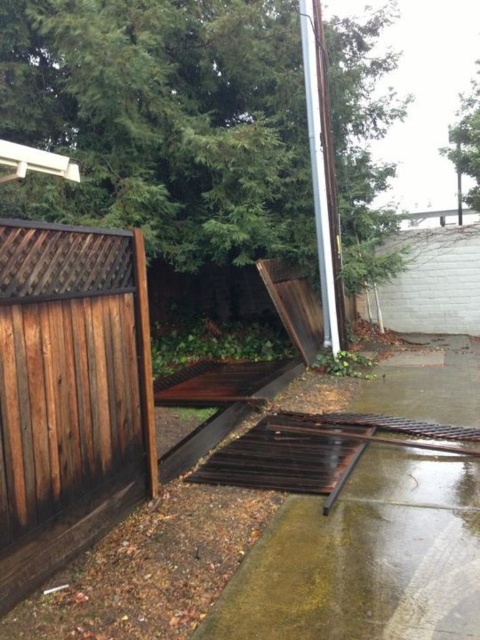
Can you confirm if brown wooden fence at left is positioned to the left of silver metallic pole at upper right?

Indeed, brown wooden fence at left is positioned on the left side of silver metallic pole at upper right.

Does point (109, 445) lie in front of point (326, 104)?

Yes, it is in front of point (326, 104).

I want to click on brown wooden fence at left, so click(x=70, y=394).